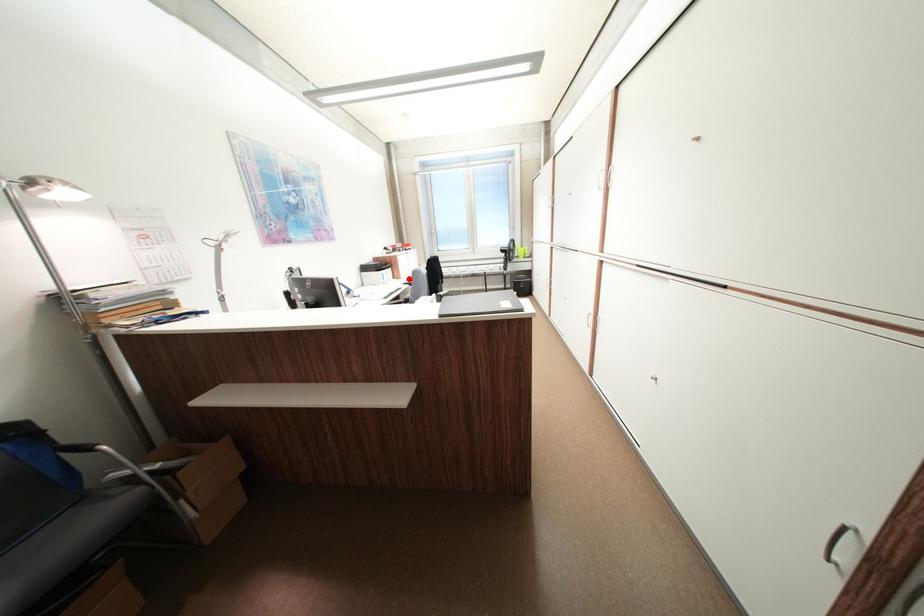
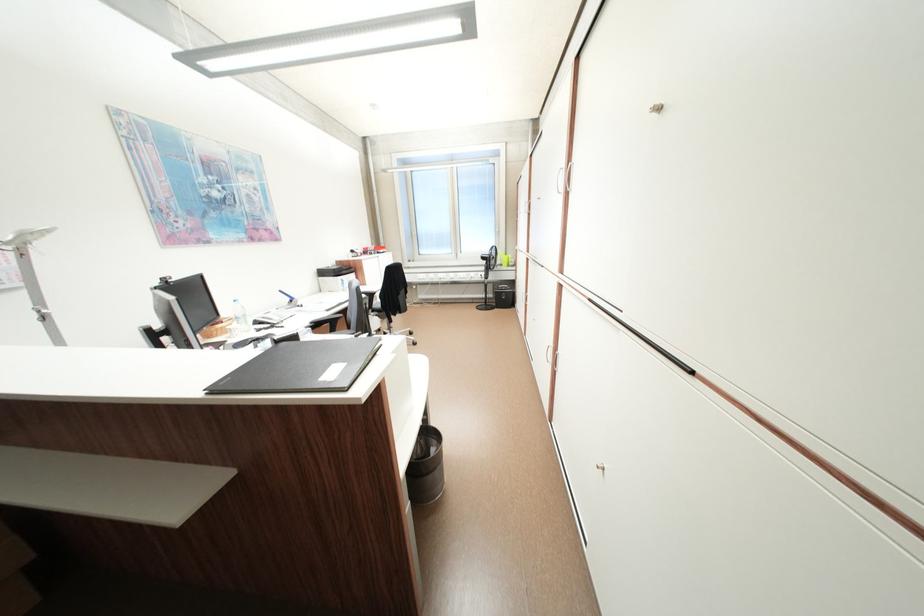
Question: I am providing you with two images of the same scene from different viewpoints. Given a red point in image1, look at the same physical point in image2. Is it:

Choices:
 (A) Closer to the viewpoint
 (B) Farther from the viewpoint

Answer: (A)